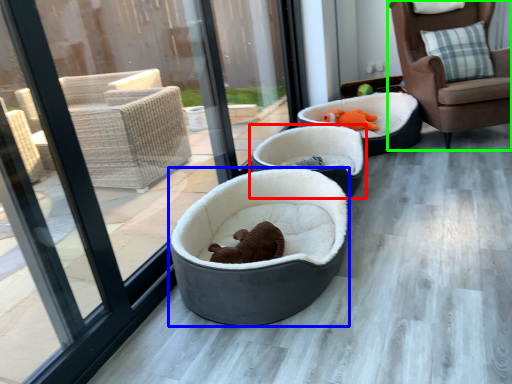
Question: Which object is positioned farthest from dog bed (highlighted by a red box)? Select from dog bed (highlighted by a blue box) and chair (highlighted by a green box).

Choices:
 (A) dog bed
 (B) chair

Answer: (B)